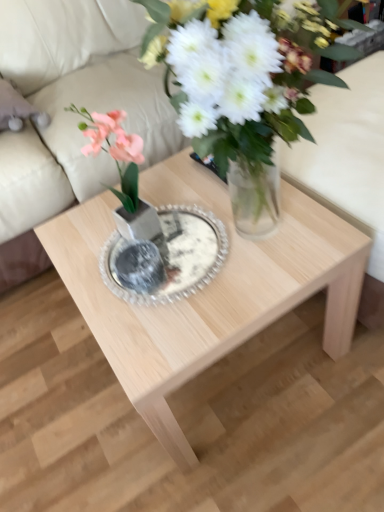
Identify the location of vacant space behind pink silk flower at center. The width and height of the screenshot is (384, 512). (157, 180).